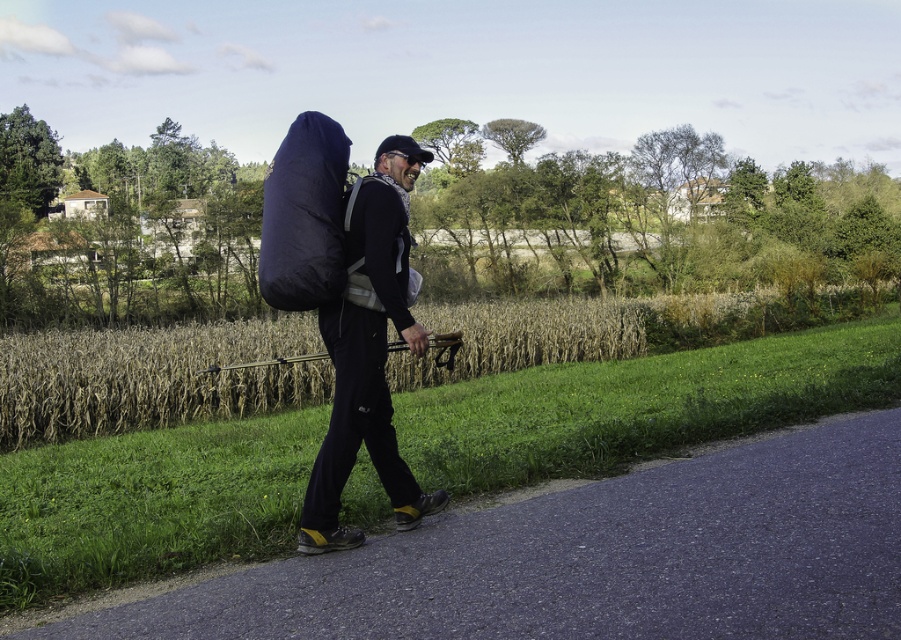
Question: Can you confirm if asphalt road at center is thinner than matte black backpack at center?

Choices:
 (A) no
 (B) yes

Answer: (A)

Question: Estimate the real-world distances between objects in this image. Which object is closer to the navy blue fabric sleeping bag at upper center?

Choices:
 (A) matte black backpack at center
 (B) asphalt road at center

Answer: (A)

Question: Which point is closer to the camera?

Choices:
 (A) matte black backpack at center
 (B) navy blue fabric sleeping bag at upper center
 (C) asphalt road at center

Answer: (C)

Question: Can you confirm if asphalt road at center is bigger than matte black backpack at center?

Choices:
 (A) no
 (B) yes

Answer: (A)

Question: Can you confirm if asphalt road at center is smaller than matte black backpack at center?

Choices:
 (A) no
 (B) yes

Answer: (B)

Question: Which object is closer to the camera taking this photo?

Choices:
 (A) matte black backpack at center
 (B) navy blue fabric sleeping bag at upper center
 (C) asphalt road at center

Answer: (C)